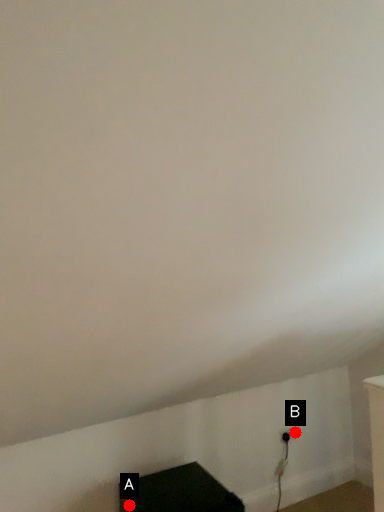
Question: Two points are circled on the image, labeled by A and B beside each circle. Among these points, which one is farthest from the camera?

Choices:
 (A) A is further
 (B) B is further

Answer: (B)